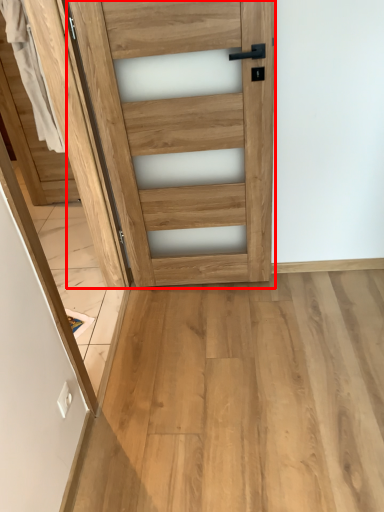
Question: Observing the image, what is the correct spatial positioning of door (annotated by the red box) in reference to screen door?

Choices:
 (A) left
 (B) right

Answer: (B)